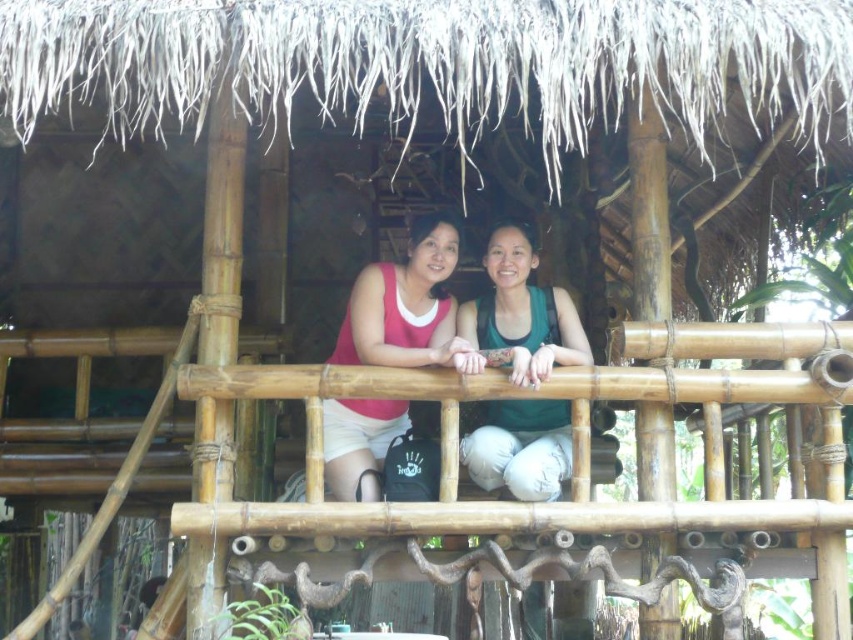
Question: Is green matte tank top at center in front of matte pink tank top at center?

Choices:
 (A) yes
 (B) no

Answer: (A)

Question: Among these objects, which one is nearest to the camera?

Choices:
 (A) green matte tank top at center
 (B) matte pink tank top at center

Answer: (A)

Question: Is green matte tank top at center to the left of matte pink tank top at center from the viewer's perspective?

Choices:
 (A) yes
 (B) no

Answer: (B)

Question: Considering the relative positions of green matte tank top at center and matte pink tank top at center in the image provided, where is green matte tank top at center located with respect to matte pink tank top at center?

Choices:
 (A) above
 (B) below

Answer: (B)

Question: Among these points, which one is nearest to the camera?

Choices:
 (A) (503, 340)
 (B) (374, 435)

Answer: (A)